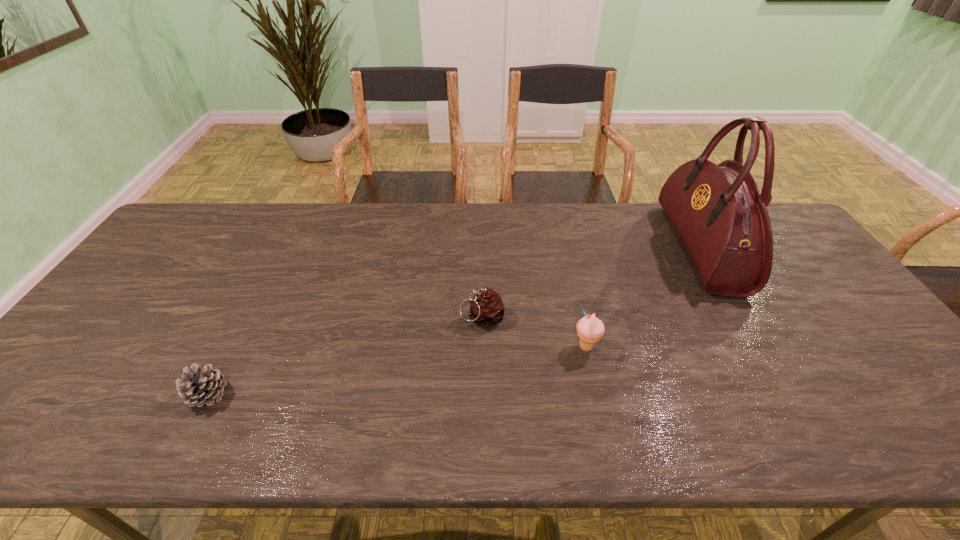
Locate an element on the screen. The width and height of the screenshot is (960, 540). free region at the left edge is located at coordinates point(87,396).

The height and width of the screenshot is (540, 960). In the image, there is a desktop. Find the location of `free space at the near left corner`. free space at the near left corner is located at coordinates (47, 420).

You are a GUI agent. You are given a task and a screenshot of the screen. Output one action in this format:
    pyautogui.click(x=<x>, y=<y>)
    Task: Click on the vacant area between the left pinecone and the rightmost object
    
    Given the screenshot: What is the action you would take?
    pyautogui.click(x=455, y=321)

The width and height of the screenshot is (960, 540). Identify the location of empty space between the second object from right to left and the farthest object. (643, 298).

You are a GUI agent. You are given a task and a screenshot of the screen. Output one action in this format:
    pyautogui.click(x=<x>, y=<y>)
    Task: Click on the vacant space that is in between the second object from right to left and the nearest object
    This screenshot has width=960, height=540.
    Given the screenshot: What is the action you would take?
    pyautogui.click(x=397, y=370)

Locate an element on the screen. vacant point located between the second object from left to right and the tallest object is located at coordinates (591, 283).

Where is `unoccupied position between the icecream and the leftmost object`? This screenshot has height=540, width=960. unoccupied position between the icecream and the leftmost object is located at coordinates (397, 370).

What are the coordinates of `free point between the third object from left to right and the rightmost object` in the screenshot? It's located at click(643, 298).

Image resolution: width=960 pixels, height=540 pixels. I want to click on free spot between the third farthest object and the leftmost object, so 397,370.

Locate an element on the screen. The height and width of the screenshot is (540, 960). free space that is in between the tallest object and the nearer pinecone is located at coordinates (455, 321).